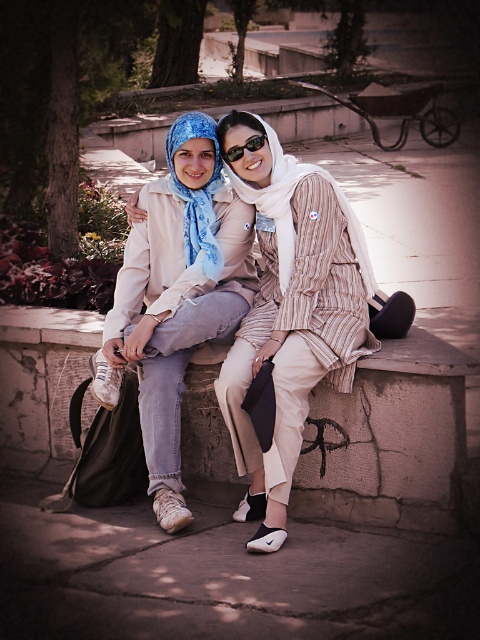
Is matte beige scarf at center thinner than blue silk scarf at center?

In fact, matte beige scarf at center might be wider than blue silk scarf at center.

Based on the photo, who is higher up, matte beige scarf at center or blue silk scarf at center?

blue silk scarf at center is above.

Where is `matte beige scarf at center`? The width and height of the screenshot is (480, 640). matte beige scarf at center is located at coordinates (289, 316).

Can you confirm if white textured scarf at center is positioned above sunglasses at center?

No, white textured scarf at center is not above sunglasses at center.

Is white textured scarf at center bigger than sunglasses at center?

Correct, white textured scarf at center is larger in size than sunglasses at center.

Which is in front, point (359, 262) or point (241, 145)?

Point (241, 145) is more forward.

This screenshot has height=640, width=480. In order to click on white textured scarf at center in this screenshot , I will do `click(290, 209)`.

In the scene shown: Can you confirm if white textured scarf at center is smaller than blue silk scarf at center?

Incorrect, white textured scarf at center is not smaller in size than blue silk scarf at center.

Which is more to the right, white textured scarf at center or blue silk scarf at center?

From the viewer's perspective, white textured scarf at center appears more on the right side.

Which is behind, point (311, 170) or point (171, 176)?

Positioned behind is point (171, 176).

Find the location of a particular element. This screenshot has height=640, width=480. white textured scarf at center is located at coordinates (290, 209).